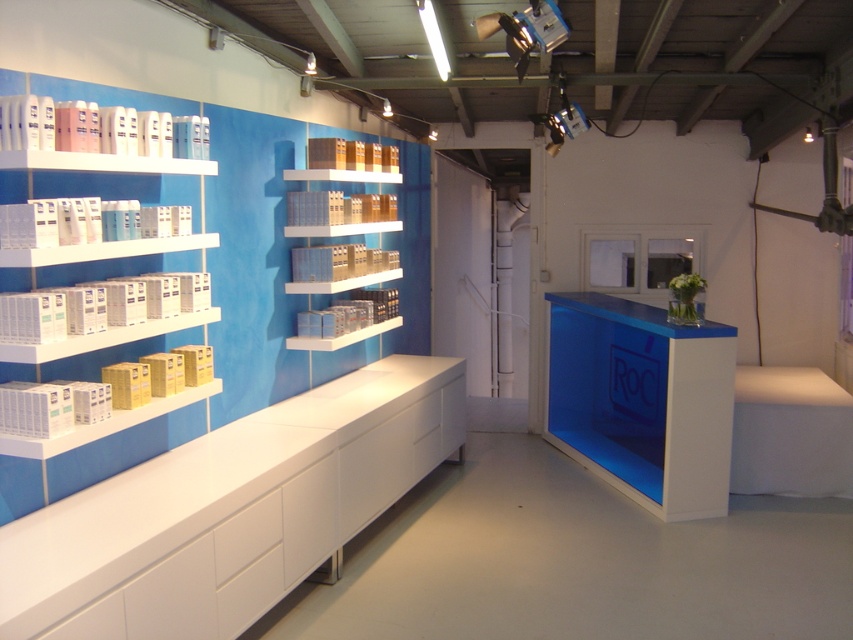
Is point (244, 592) more distant than point (172, 192)?

No.

Can you confirm if white glossy cabinet at lower left is positioned above white plastic boxes at left?

Actually, white glossy cabinet at lower left is below white plastic boxes at left.

Identify the location of white glossy cabinet at lower left. (230, 509).

Where is `white glossy cabinet at lower left`? white glossy cabinet at lower left is located at coordinates (230, 509).

Does blue glossy counter at center have a larger size compared to white glossy boxes at left?

Indeed, blue glossy counter at center has a larger size compared to white glossy boxes at left.

Is point (583, 435) positioned in front of point (183, 236)?

No.

Does point (683, 340) lie in front of point (138, 252)?

No, (683, 340) is behind (138, 252).

Where is `blue glossy counter at center`? blue glossy counter at center is located at coordinates (642, 401).

Between blue glossy counter at center and white plastic boxes at left, which one has more height?

blue glossy counter at center

Is blue glossy counter at center to the right of white plastic boxes at left from the viewer's perspective?

Indeed, blue glossy counter at center is positioned on the right side of white plastic boxes at left.

Identify the location of blue glossy counter at center. (642, 401).

At what (x,y) coordinates should I click in order to perform the action: click on blue glossy counter at center. Please return your answer as a coordinate pair (x, y). This screenshot has height=640, width=853. Looking at the image, I should click on (642, 401).